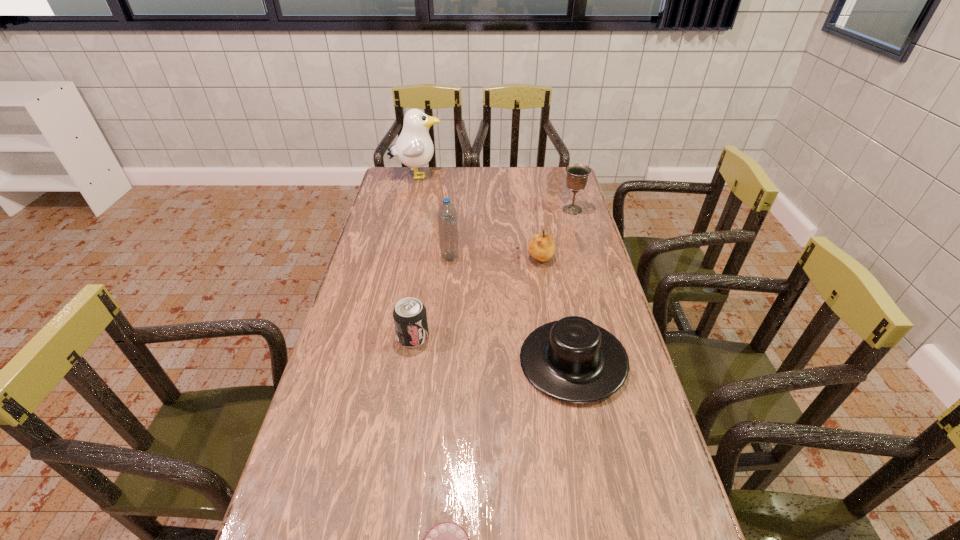
The height and width of the screenshot is (540, 960). I want to click on the tallest object, so click(414, 148).

The image size is (960, 540). In order to click on gull in this screenshot , I will do `click(414, 148)`.

You are a GUI agent. You are given a task and a screenshot of the screen. Output one action in this format:
    pyautogui.click(x=<x>, y=<y>)
    Task: Click on the sixth shortest object
    
    Given the screenshot: What is the action you would take?
    pyautogui.click(x=447, y=215)

Locate an element on the screen. This screenshot has height=540, width=960. the fifth shortest object is located at coordinates (577, 174).

Locate an element on the screen. The image size is (960, 540). chalice is located at coordinates (577, 174).

The height and width of the screenshot is (540, 960). In order to click on pear in this screenshot , I will do `click(541, 247)`.

This screenshot has width=960, height=540. Identify the location of soda can. (410, 317).

At what (x,y) coordinates should I click in order to perform the action: click on dress hat. Please return your answer as a coordinate pair (x, y). Image resolution: width=960 pixels, height=540 pixels. Looking at the image, I should click on (573, 360).

Where is `free region located on the beak of the tallest object`? This screenshot has width=960, height=540. free region located on the beak of the tallest object is located at coordinates (457, 176).

Locate an element on the screen. This screenshot has height=540, width=960. vacant region located on the left of the sixth shortest object is located at coordinates (374, 257).